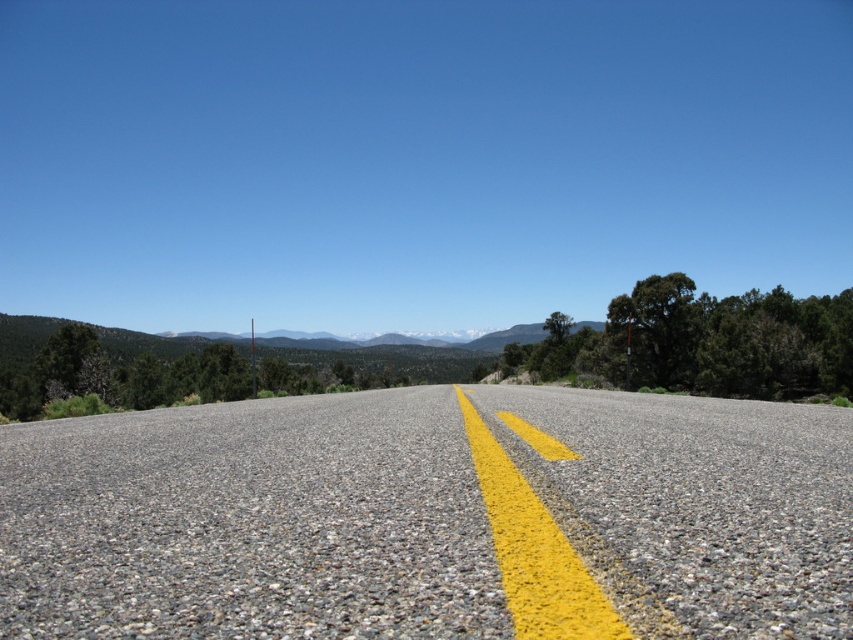
You are a road inspector checking the safety of the road. The safety regulation states that the minimum distance between the gravel and the yellow painted line must be at least 4 meters. Based on the image, does the current distance between the gray gravel at center and the yellow painted line at center meet the safety requirement?

The gray gravel at center is 4.15 meters from the yellow painted line at center. Since 4.15 meters exceeds the minimum requirement of 4 meters, the current distance meets the safety requirement.